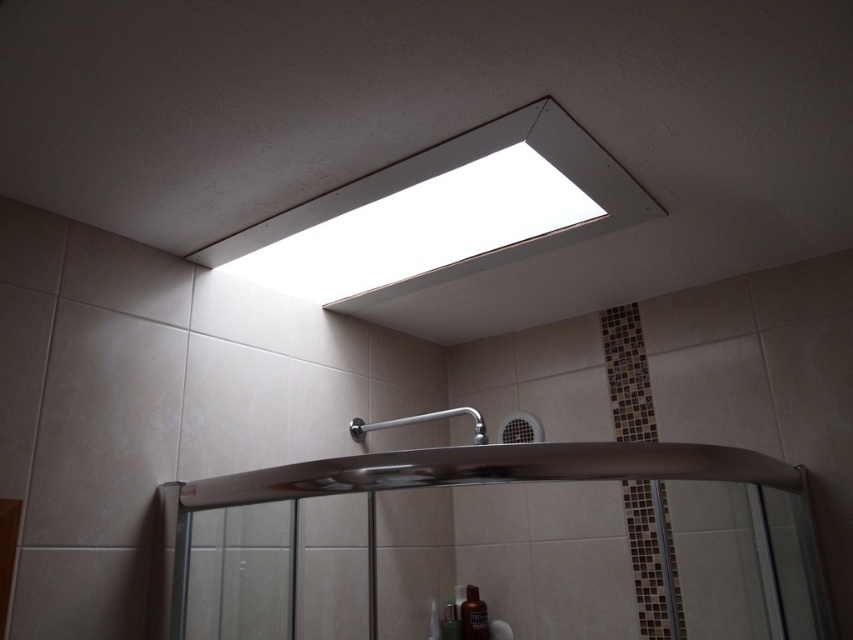
Is white fluorescent light at upper center smaller than translucent plastic bottle at lower center?

No.

Who is higher up, white fluorescent light at upper center or translucent plastic bottle at lower center?

white fluorescent light at upper center

Is point (347, 243) farther from camera compared to point (461, 605)?

No, it is in front of (461, 605).

The height and width of the screenshot is (640, 853). Identify the location of white fluorescent light at upper center. tap(422, 228).

Can you confirm if satin nickel shower at center is positioned to the left of translucent plastic bottle at lower center?

Yes, satin nickel shower at center is to the left of translucent plastic bottle at lower center.

Is satin nickel shower at center smaller than translucent plastic bottle at lower center?

No.

The image size is (853, 640). In order to click on satin nickel shower at center in this screenshot , I will do `click(419, 422)`.

I want to click on satin nickel shower at center, so click(419, 422).

Does white fluorescent light at upper center have a larger size compared to satin nickel shower at center?

Indeed, white fluorescent light at upper center has a larger size compared to satin nickel shower at center.

Can you confirm if white fluorescent light at upper center is smaller than satin nickel shower at center?

No, white fluorescent light at upper center is not smaller than satin nickel shower at center.

What are the coordinates of `white fluorescent light at upper center` in the screenshot? It's located at (422, 228).